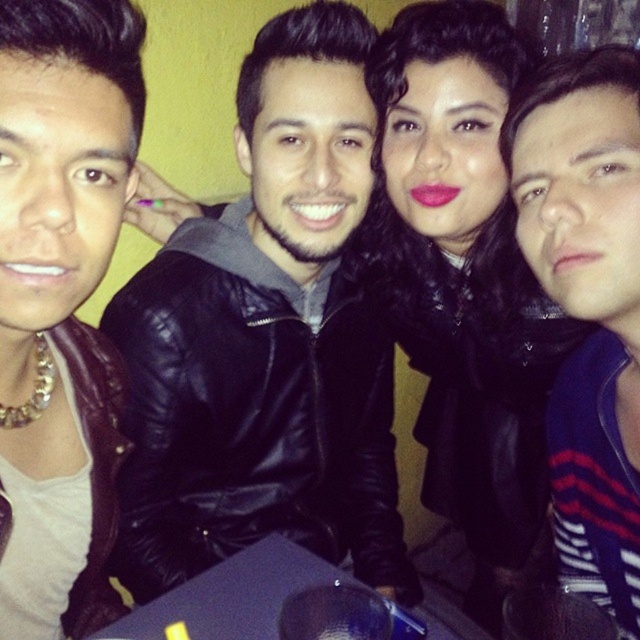
You are trying to locate the black leather jacket at center in the photograph. According to the coordinates provided, where exactly is it positioned?

The black leather jacket at center is located at the 2D coordinates point (266, 339).